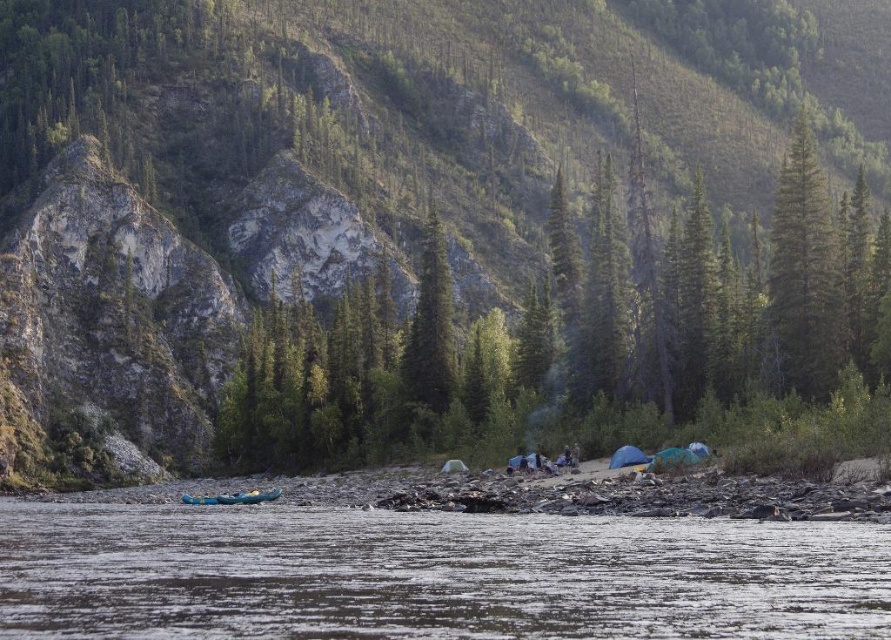
Is point (810, 227) positioned before point (446, 371)?

Yes.

Identify the location of green matte tree at upper right. (803, 275).

Between clear water at lower center and teal rubber boat at lower left, which one has more height?

clear water at lower center is taller.

Between clear water at lower center and teal rubber boat at lower left, which one appears on the left side from the viewer's perspective?

Positioned to the left is teal rubber boat at lower left.

Does point (571, 602) lie in front of point (211, 499)?

Yes, it is.

The width and height of the screenshot is (891, 640). What are the coordinates of `clear water at lower center` in the screenshot? It's located at (429, 573).

Can you confirm if green textured tree at center is wider than teal rubber boat at lower left?

No, green textured tree at center is not wider than teal rubber boat at lower left.

Who is taller, green textured tree at center or teal rubber boat at lower left?

With more height is green textured tree at center.

The image size is (891, 640). I want to click on green textured tree at center, so click(x=430, y=330).